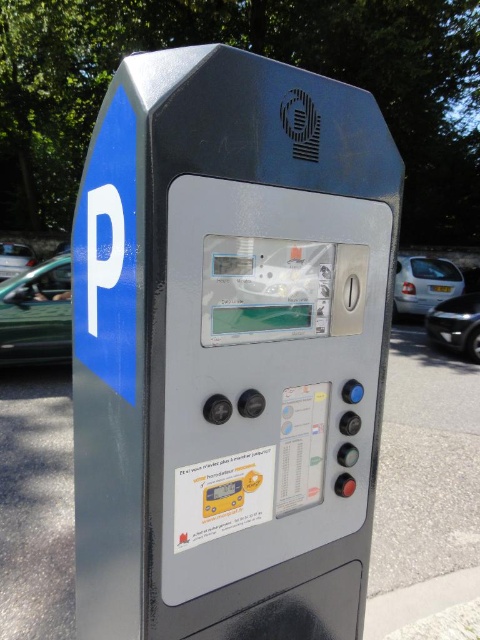
Question: Which is nearer to the white glossy car at right?

Choices:
 (A) metallic parking meter at center
 (B) green matte car at left

Answer: (B)

Question: Which object appears farthest from the camera in this image?

Choices:
 (A) green matte car at left
 (B) metallic silver car at left

Answer: (B)

Question: Does metallic parking meter at center appear on the left side of white glossy car at right?

Choices:
 (A) no
 (B) yes

Answer: (B)

Question: Does metallic parking meter at center have a larger size compared to white glossy car at right?

Choices:
 (A) no
 (B) yes

Answer: (B)

Question: Can you confirm if green matte car at left is thinner than white glossy car at right?

Choices:
 (A) no
 (B) yes

Answer: (A)

Question: Which of the following is the closest to the observer?

Choices:
 (A) metallic silver car at left
 (B) black glossy car at right

Answer: (B)